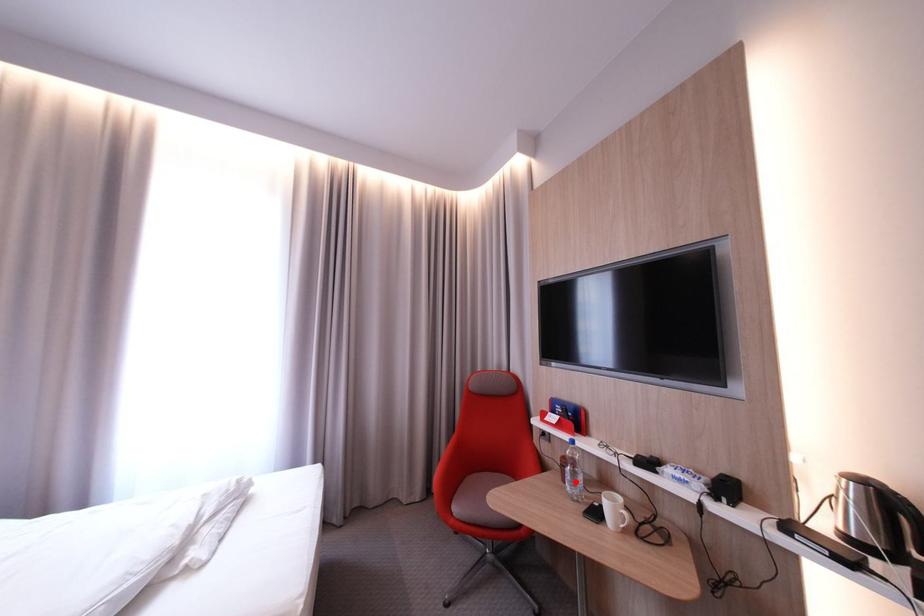
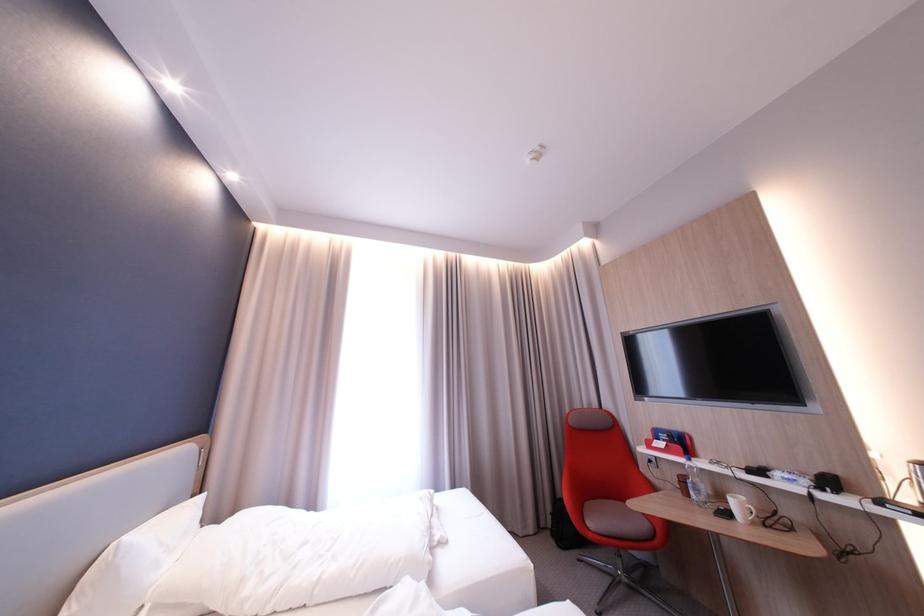
Question: I am providing you with two images of the same scene from different viewpoints. A red point is marked on the first image. Can you still see the location of the red point in image 2?

Choices:
 (A) Yes
 (B) No

Answer: (A)